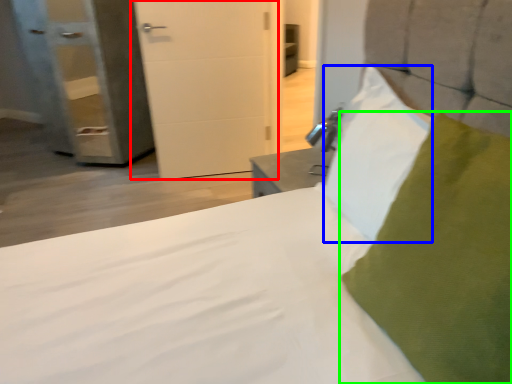
Question: Which is nearer to the door (highlighted by a red box)? pillow (highlighted by a blue box) or pillow (highlighted by a green box).

Choices:
 (A) pillow
 (B) pillow

Answer: (A)